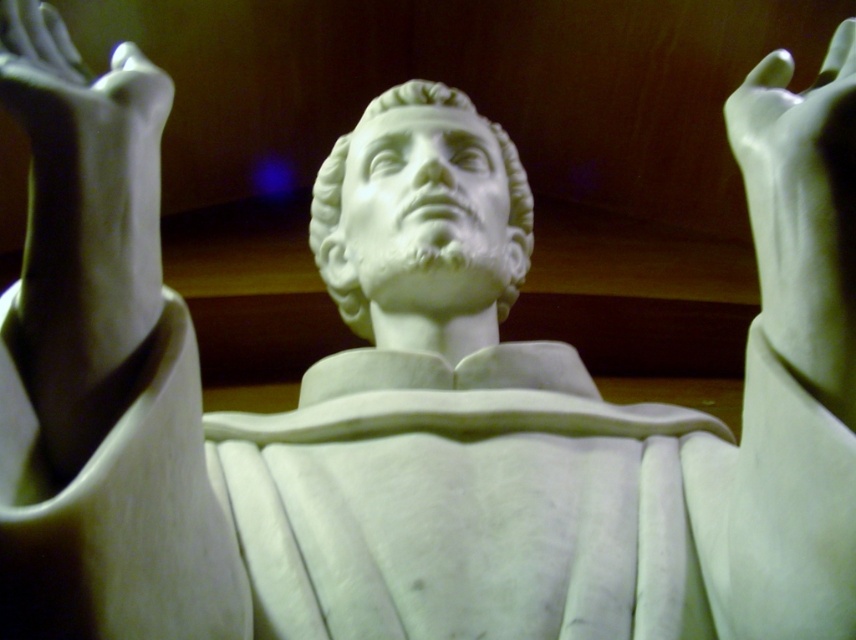
Question: Is white marble hand at upper right to the left of white marble bust at center from the viewer's perspective?

Choices:
 (A) no
 (B) yes

Answer: (A)

Question: Considering the relative positions of white marble hand at upper right and white marble bust at center in the image provided, where is white marble hand at upper right located with respect to white marble bust at center?

Choices:
 (A) right
 (B) left

Answer: (A)

Question: In this image, where is white marble hand at upper right located relative to white marble bust at center?

Choices:
 (A) right
 (B) left

Answer: (A)

Question: Which point appears closest to the camera in this image?

Choices:
 (A) (801, 192)
 (B) (506, 298)

Answer: (A)